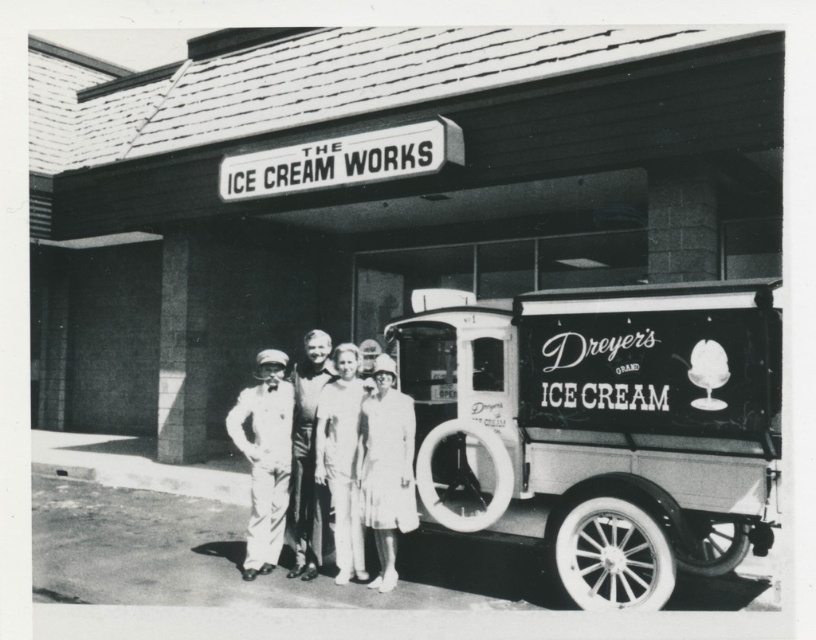
You are standing in front of the vintage ice cream truck and want to place a new sign at one of the two points marked on the truck. The first point is at coordinate point (659, 36) and the second is at point (408, 422). Which point is closer to you so that the sign is more visible?

Point (659, 36) is closer to you than point (408, 422), so placing the sign there would make it more visible.